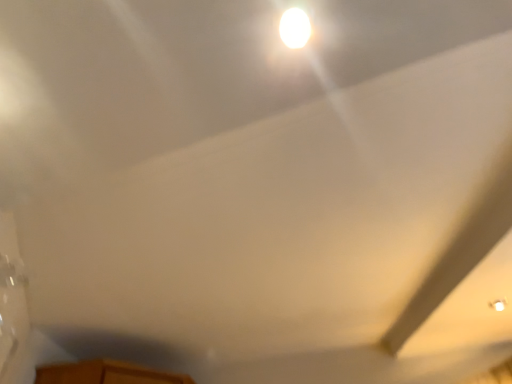
Question: From a real-world perspective, is white matte exhaust hood at upper right positioned above or below white glossy light bulb at upper center?

Choices:
 (A) above
 (B) below

Answer: (A)

Question: Considering the positions of white matte exhaust hood at upper right and white glossy light bulb at upper center in the image, is white matte exhaust hood at upper right bigger or smaller than white glossy light bulb at upper center?

Choices:
 (A) big
 (B) small

Answer: (A)

Question: From the image's perspective, is white matte exhaust hood at upper right above or below white glossy light bulb at upper center?

Choices:
 (A) above
 (B) below

Answer: (B)

Question: Considering the positions of white glossy light bulb at upper center and white matte exhaust hood at upper right in the image, is white glossy light bulb at upper center wider or thinner than white matte exhaust hood at upper right?

Choices:
 (A) thin
 (B) wide

Answer: (A)

Question: From a real-world perspective, is white glossy light bulb at upper center above or below white matte exhaust hood at upper right?

Choices:
 (A) above
 (B) below

Answer: (B)

Question: Does point (290, 18) appear closer or farther from the camera than point (401, 319)?

Choices:
 (A) farther
 (B) closer

Answer: (B)

Question: Considering the positions of white glossy light bulb at upper center and white matte exhaust hood at upper right in the image, is white glossy light bulb at upper center taller or shorter than white matte exhaust hood at upper right?

Choices:
 (A) tall
 (B) short

Answer: (B)